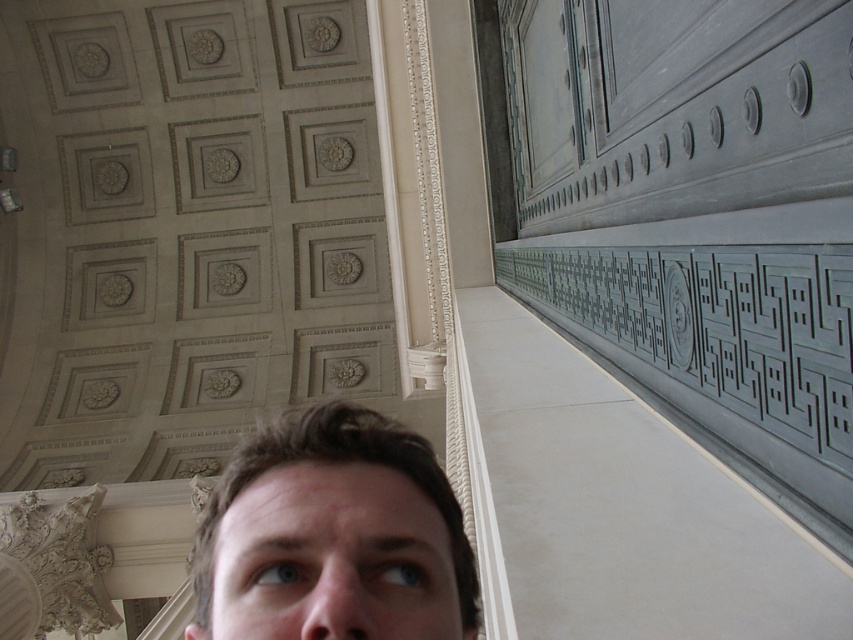
Question: Is brown hair at center positioned behind gray stone carving at right?

Choices:
 (A) no
 (B) yes

Answer: (B)

Question: Is brown hair at center positioned at the back of gray stone carving at right?

Choices:
 (A) no
 (B) yes

Answer: (B)

Question: Which point is closer to the camera?

Choices:
 (A) brown hair at center
 (B) gray stone carving at right

Answer: (B)

Question: Is brown hair at center above gray stone carving at right?

Choices:
 (A) no
 (B) yes

Answer: (A)

Question: Which object appears closest to the camera in this image?

Choices:
 (A) brown hair at center
 (B) gray stone carving at right

Answer: (B)